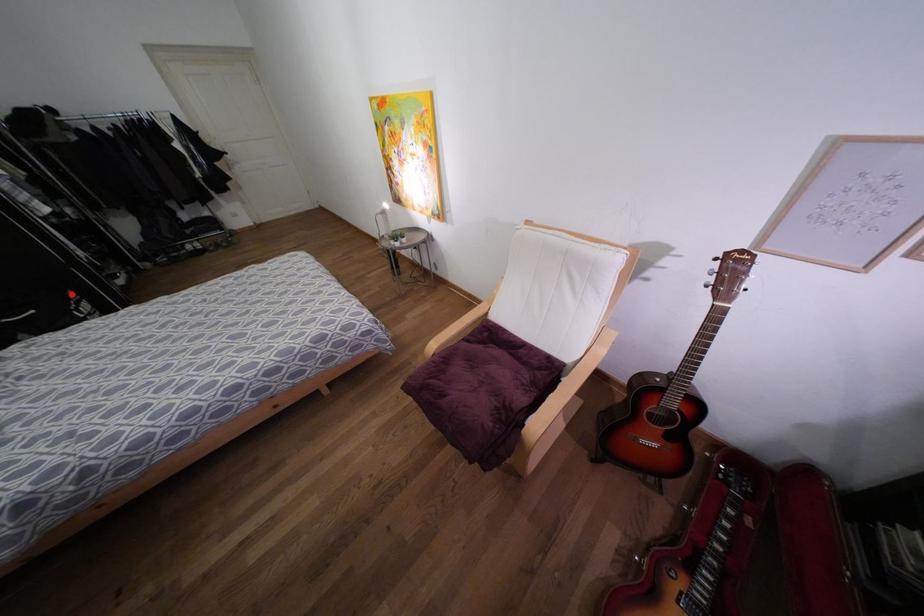
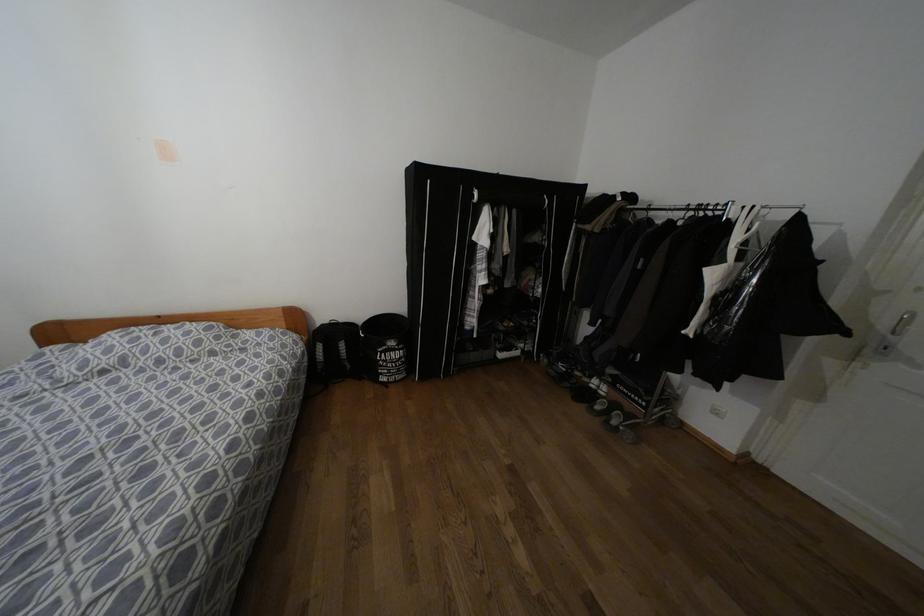
Where in the second image is the point corresponding to the highlighted location from the first image?

(391, 342)